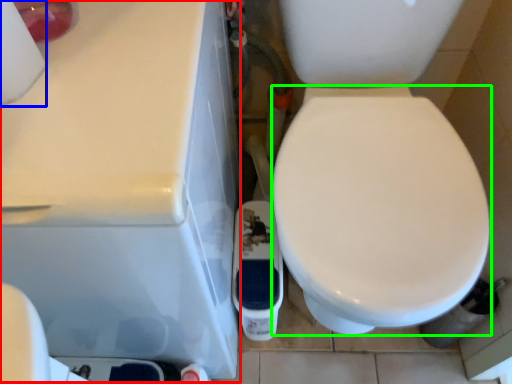
Question: Estimate the real-world distances between objects in this image. Which object is farther from porcelain (highlighted by a red box), toilet paper (highlighted by a blue box) or bidet (highlighted by a green box)?

Choices:
 (A) toilet paper
 (B) bidet

Answer: (B)